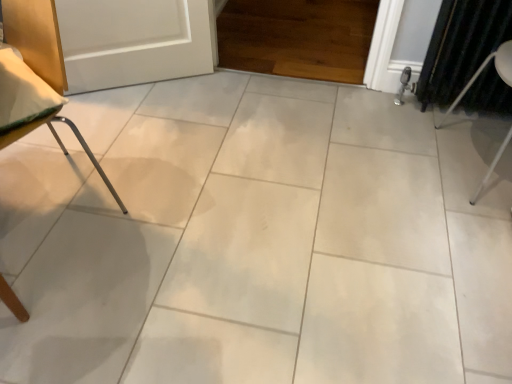
This screenshot has height=384, width=512. I want to click on free space between white metal chair at right, the second furniture viewed from the left, and dark green fabric curtain at right, so click(x=440, y=134).